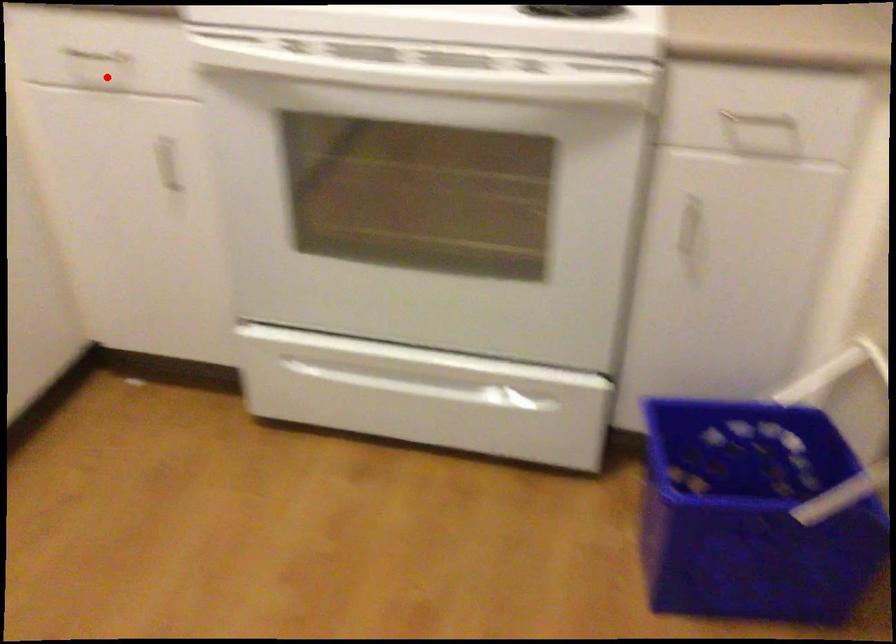
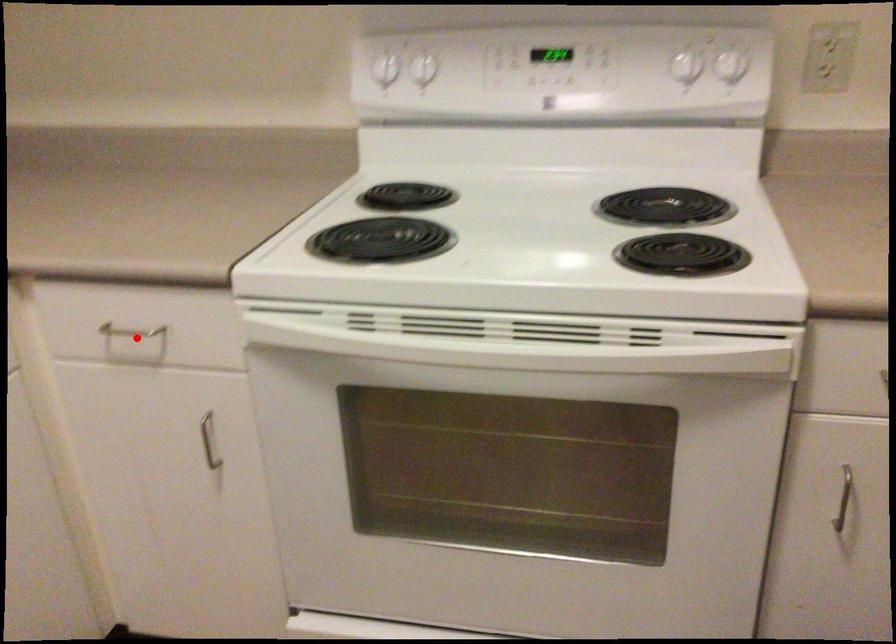
I am providing you with two images of the same scene from different viewpoints. A red point is marked on the first image and another point is marked on the second image. Does the point marked in image1 correspond to the same location as the one in image2?

Yes